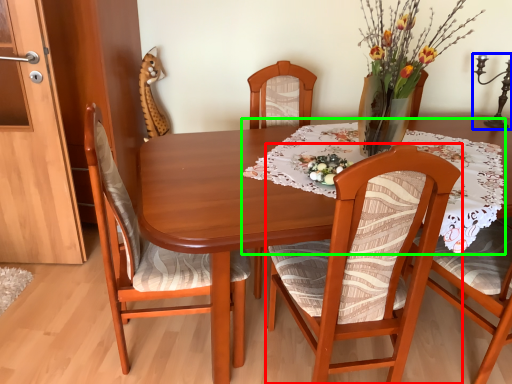
Question: Which object is the closest to the chair (highlighted by a red box)? Choose among these: candle holder (highlighted by a blue box) or tablecloth (highlighted by a green box).

Choices:
 (A) candle holder
 (B) tablecloth

Answer: (B)